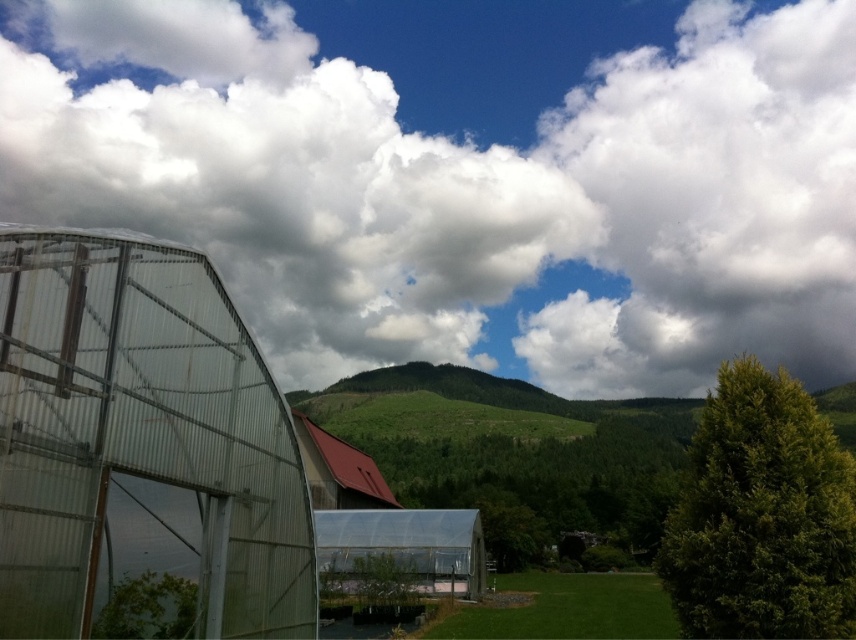
You are a pilot flying a small plane and need to navigate around the white fluffy cloud at upper center and the green textured tree at right. Which object is higher in the sky?

The white fluffy cloud at upper center is located above the green textured tree at right, so it is higher in the sky.

You are standing in the middle of the field and looking at the image. There is a point marked at coordinates (467, 176). What object in the scene corresponds to this point?

The point at coordinates (467, 176) corresponds to the white fluffy cloud at upper center.

You are standing in the rural landscape scene. There is a point marked at coordinates point (467, 176). What object in the scene is located at that point?

The white fluffy cloud at upper center is located at point (467, 176).